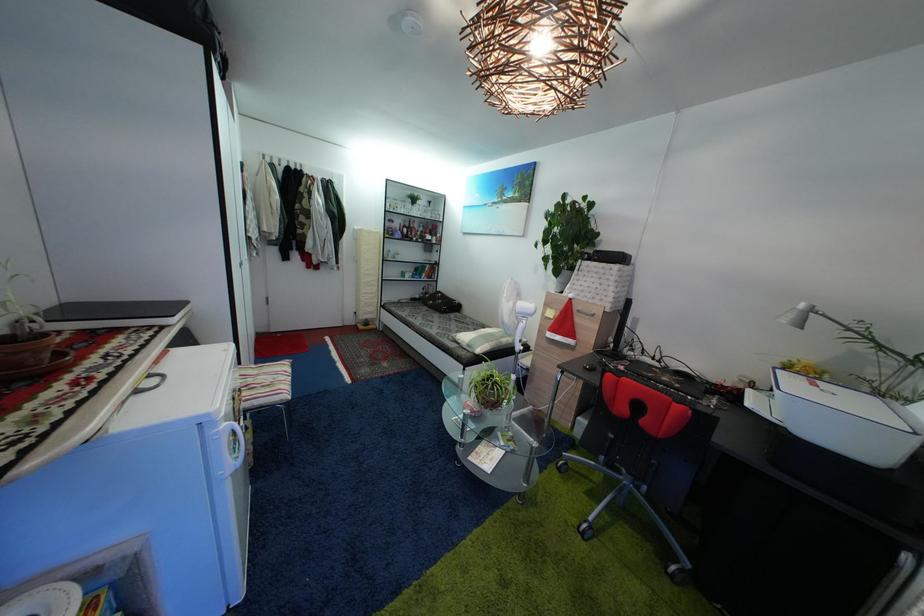
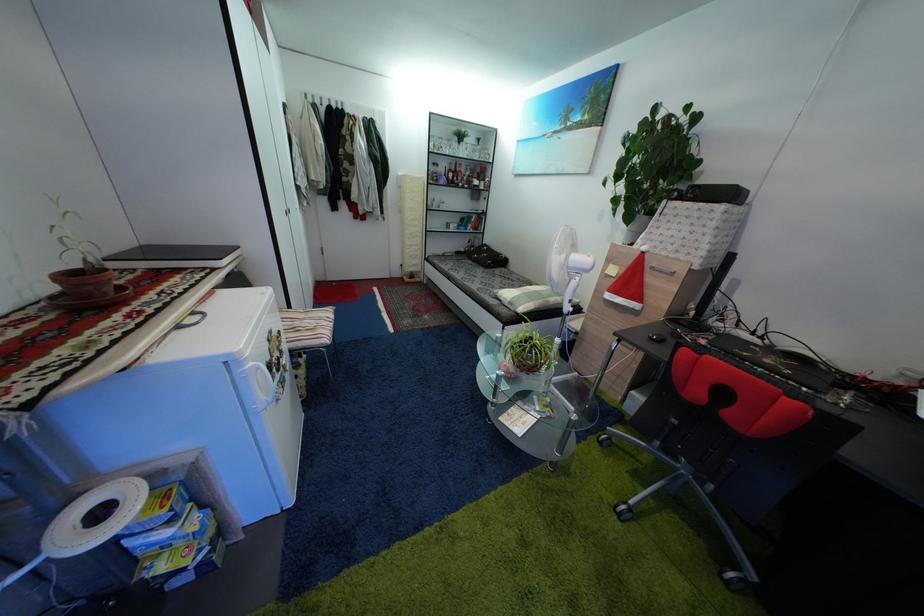
Find the pixel in the second image that matches the point at 224,432 in the first image.

(249, 371)